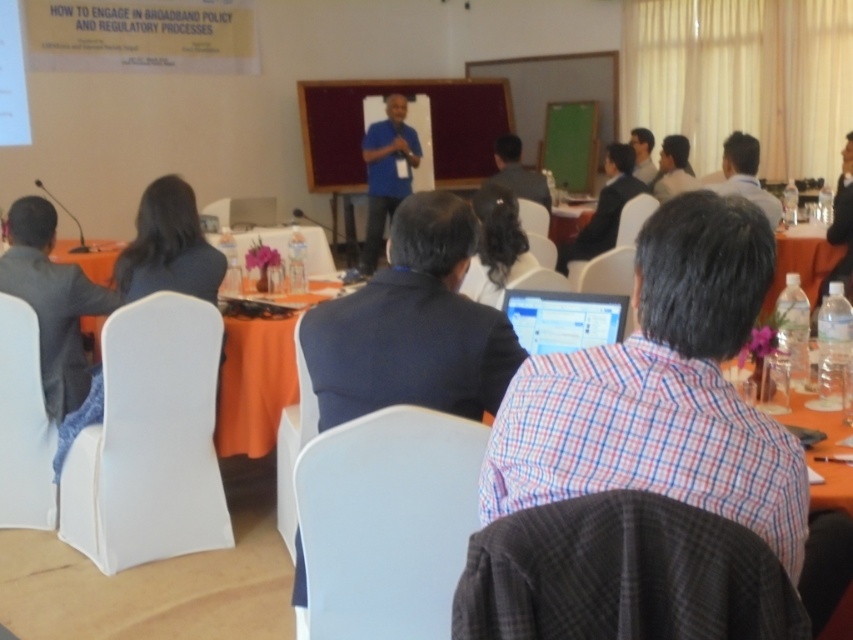
In the scene shown: Is the position of black hair at upper center more distant than that of matte black shirt at upper center?

No, black hair at upper center is in front of matte black shirt at upper center.

Based on the photo, between black hair at upper center and matte black shirt at upper center, which one is positioned lower?

black hair at upper center

Who is more forward, (506,218) or (643,154)?

Point (506,218)

I want to click on black hair at upper center, so click(496, 246).

Who is more forward, (x=413, y=129) or (x=608, y=216)?

Point (x=608, y=216) is in front.

The height and width of the screenshot is (640, 853). What are the coordinates of `blue matte shirt at center` in the screenshot? It's located at (386, 173).

The height and width of the screenshot is (640, 853). I want to click on blue matte shirt at center, so click(386, 173).

Between clear plastic bottles at right and matte black laptop at upper center, which one appears on the right side from the viewer's perspective?

matte black laptop at upper center

This screenshot has height=640, width=853. What do you see at coordinates (802, 262) in the screenshot?
I see `clear plastic bottles at right` at bounding box center [802, 262].

Who is more distant from viewer, (811, 230) or (851, 225)?

Point (811, 230)

Identify the location of clear plastic bottles at right. (802, 262).